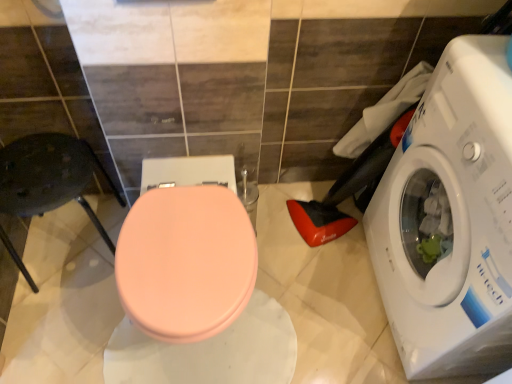
This screenshot has height=384, width=512. Identify the location of blank space situated above metallic dark gray chair at left (from a real-world perspective). (40, 175).